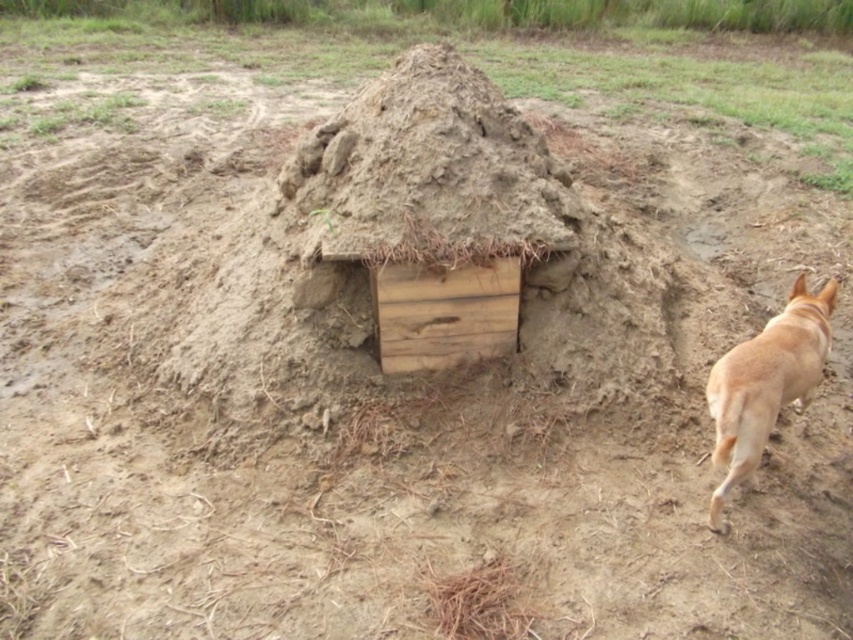
You are standing in front of the shelter and notice the clayey dirt mound at center. Based on its coordinates, is it closer to the left or right side of the image?

The clayey dirt mound at center is located at point 0.270 on the x axis, which is closer to the left side of the image since 0.270 is less than 0.5.

You are planning to build a small garden in the open, grassy area where the shelter is located. Considering the clayey dirt mound at center and the brown furry dog at right, which object takes up more space in the scene?

The brown furry dog at right occupies more space than the clayey dirt mound at center according to the description provided.